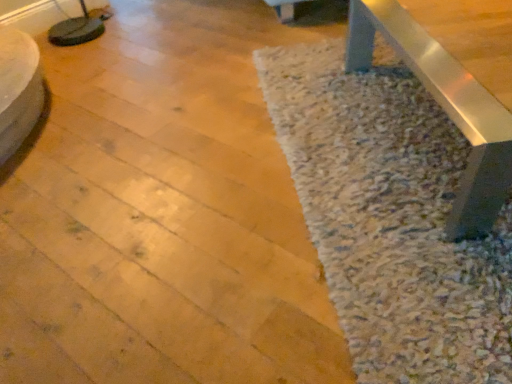
What do you see at coordinates (391, 218) in the screenshot?
I see `white shaggy rug at center` at bounding box center [391, 218].

Identify the location of white shaggy rug at center. (391, 218).

You are a GUI agent. You are given a task and a screenshot of the screen. Output one action in this format:
    pyautogui.click(x=<x>, y=<y>)
    Task: Click on the white shaggy rug at center
    
    Given the screenshot: What is the action you would take?
    pyautogui.click(x=391, y=218)